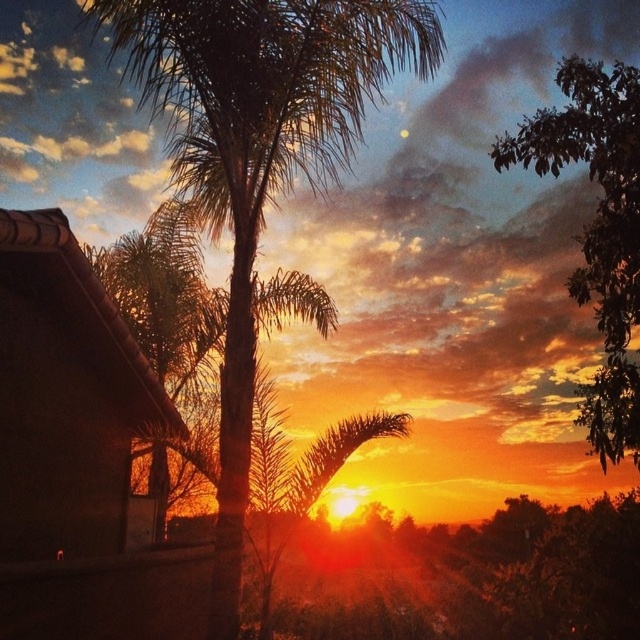
You are an architect designing a new garden and want to place both the green leafy palm tree at center and the green leafy tree at upper right in your design. Based on their sizes, which tree should be placed closer to the entrance to ensure the smaller tree doesn

The green leafy palm tree at center is shorter than the green leafy tree at upper right, so to ensure the smaller tree is closer to the entrance, place the green leafy palm tree at center near the entrance.

You are an architect designing a new garden and want to replicate the sunset scene. You have both a green leafy palm tree at center and a green leafy tree at upper right. Which tree should you place lower in your garden design to match the original image?

The green leafy palm tree at center should be placed lower in your garden design because it is located below the green leafy tree at upper right in the original image.